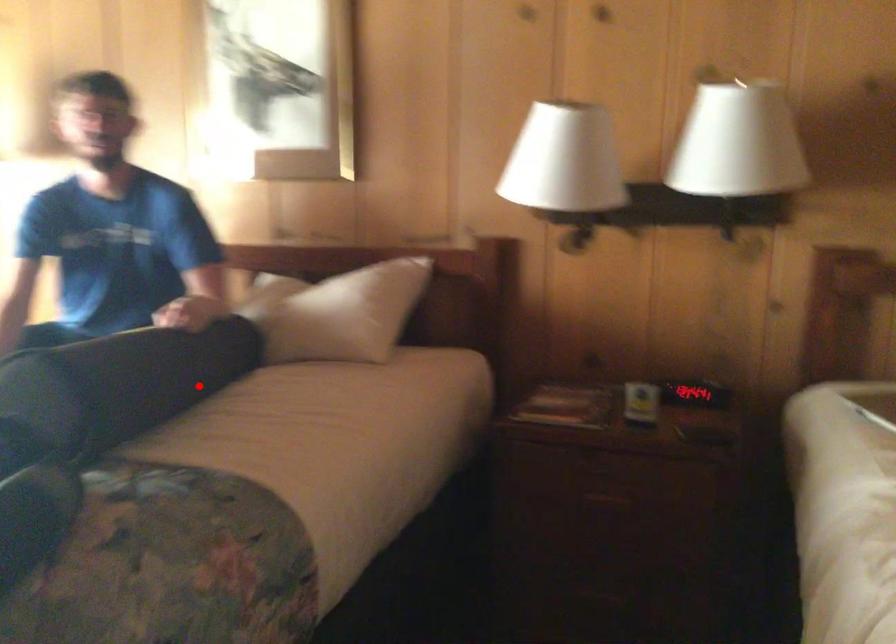
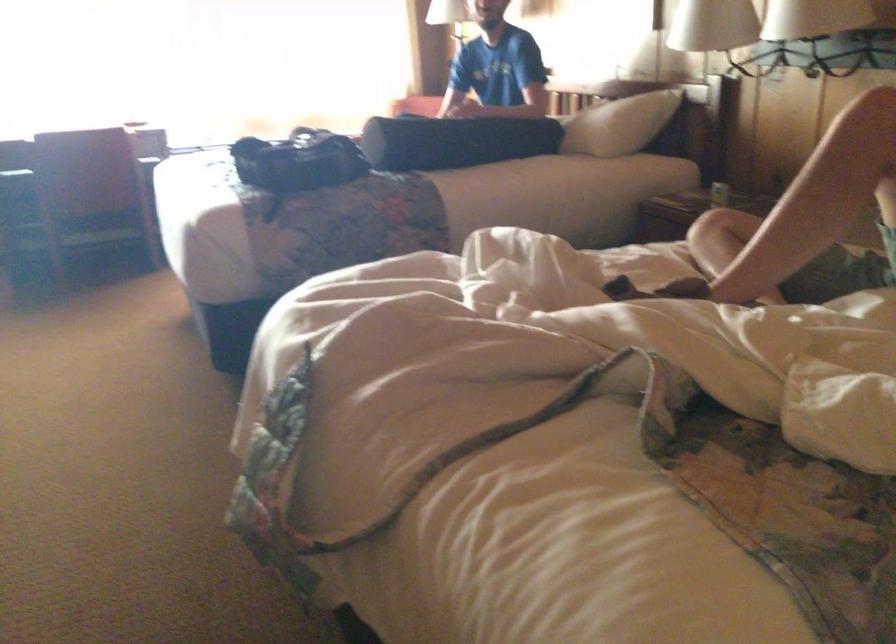
Question: A red point is marked in image1. In image2, is the corresponding 3D point closer to the camera or farther? Reply with the corresponding letter.

Choices:
 (A) The corresponding 3D point is closer.
 (B) The corresponding 3D point is farther.

Answer: (B)